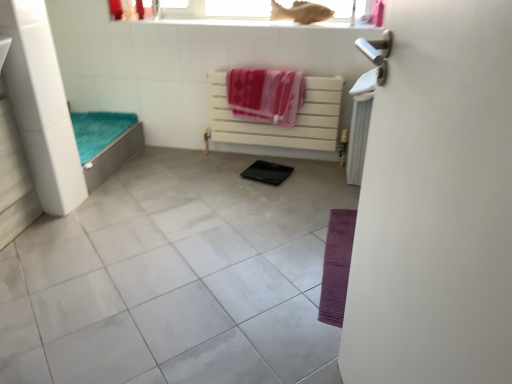
Question: From the image's perspective, would you say white glossy tile at center is shown under white plastic radiator at center?

Choices:
 (A) yes
 (B) no

Answer: (A)

Question: Does white glossy tile at center appear on the left side of white plastic radiator at center?

Choices:
 (A) yes
 (B) no

Answer: (A)

Question: Considering the relative sizes of white glossy tile at center and white plastic radiator at center in the image provided, is white glossy tile at center thinner than white plastic radiator at center?

Choices:
 (A) no
 (B) yes

Answer: (A)

Question: Is white glossy tile at center facing away from white plastic radiator at center?

Choices:
 (A) no
 (B) yes

Answer: (A)

Question: Is white glossy tile at center not within white plastic radiator at center?

Choices:
 (A) yes
 (B) no

Answer: (A)

Question: Is white glossy tile at center bigger than white plastic radiator at center?

Choices:
 (A) yes
 (B) no

Answer: (A)

Question: Does pink fabric beach towel at upper right, placed as the 2th beach towel when sorted from left to right, appear on the left side of white glossy screen door at right?

Choices:
 (A) yes
 (B) no

Answer: (B)

Question: Is the position of pink fabric beach towel at upper right, placed as the 2th beach towel when sorted from left to right, less distant than that of white glossy screen door at right?

Choices:
 (A) yes
 (B) no

Answer: (B)

Question: From a real-world perspective, is pink fabric beach towel at upper right, placed as the 2th beach towel when sorted from left to right, over white glossy screen door at right?

Choices:
 (A) no
 (B) yes

Answer: (B)

Question: Is pink fabric beach towel at upper right, placed as the 2th beach towel when sorted from left to right, aimed at white glossy screen door at right?

Choices:
 (A) yes
 (B) no

Answer: (A)

Question: Is pink fabric beach towel at upper right, positioned as the 1th beach towel in right-to-left order, bigger than white glossy screen door at right?

Choices:
 (A) no
 (B) yes

Answer: (A)

Question: Are pink fabric beach towel at upper right, placed as the 2th beach towel when sorted from left to right, and white glossy screen door at right making contact?

Choices:
 (A) yes
 (B) no

Answer: (B)

Question: Is pink fabric beach towel at center, acting as the first beach towel starting from the left, smaller than white glossy screen door at right?

Choices:
 (A) no
 (B) yes

Answer: (B)